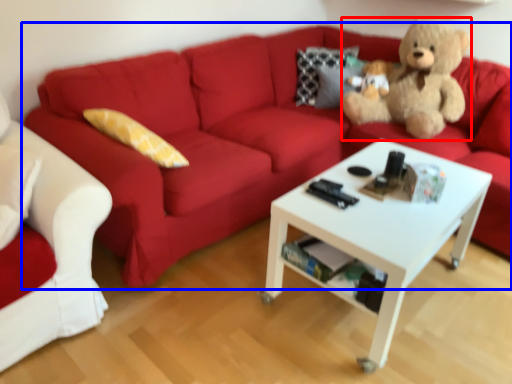
Question: Which of the following is the closest to the observer, teddy bear (highlighted by a red box) or studio couch (highlighted by a blue box)?

Choices:
 (A) teddy bear
 (B) studio couch

Answer: (B)